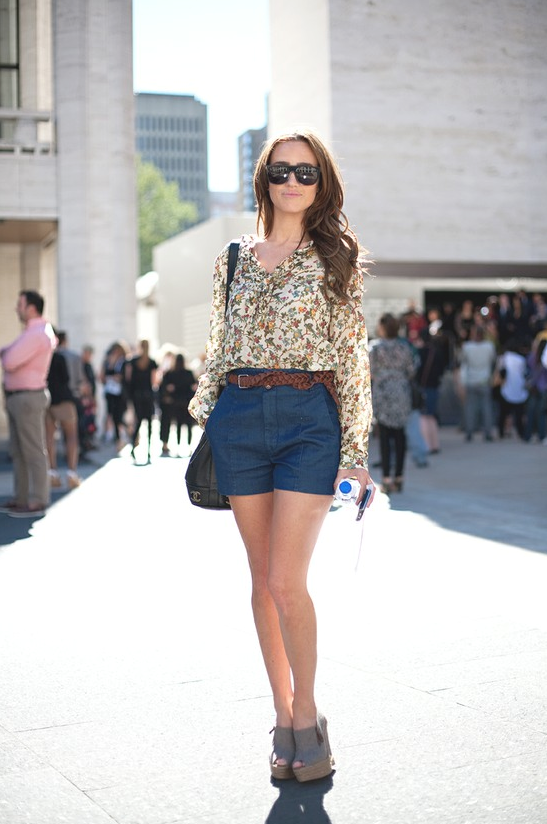
The width and height of the screenshot is (547, 824). In order to click on bottle in this screenshot , I will do `click(349, 494)`.